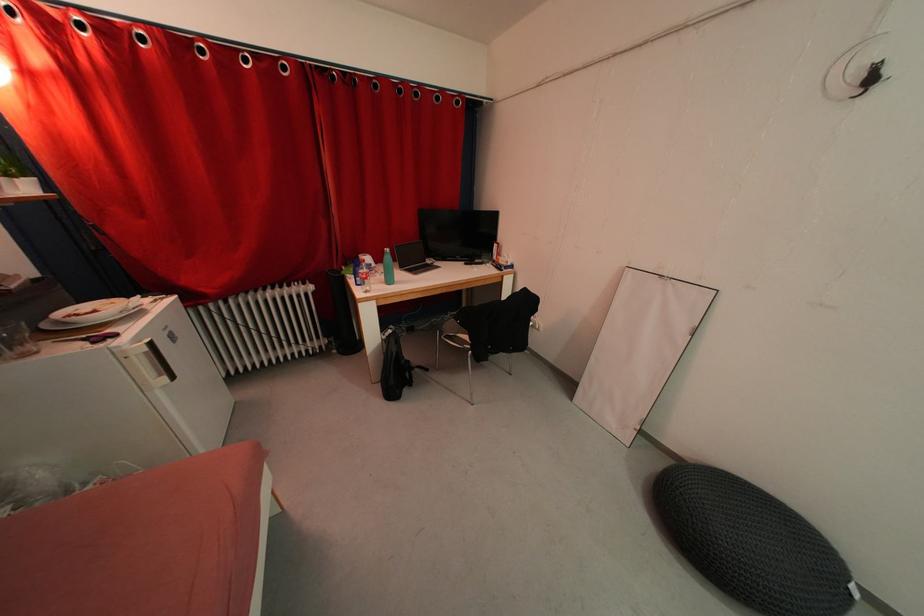
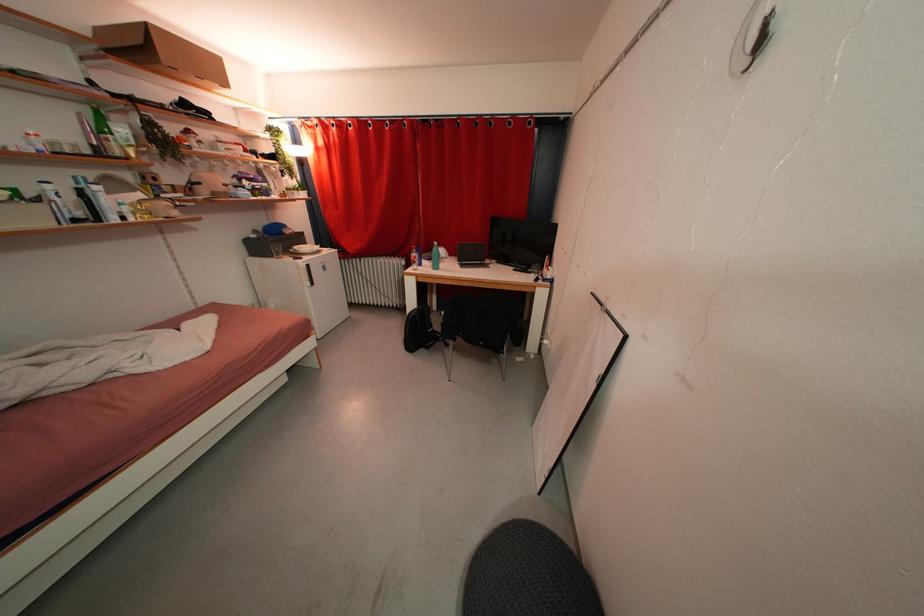
In the second image, find the point that corresponds to (399,353) in the first image.

(419, 317)